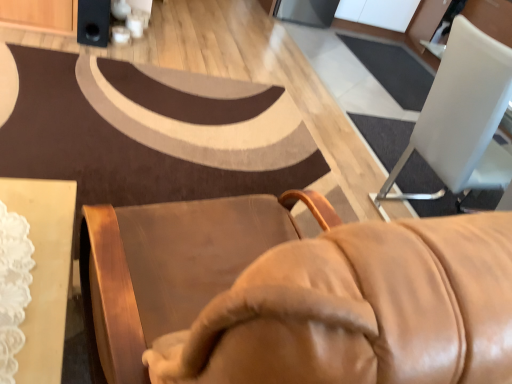
Question: From the image's perspective, is black matte speaker at upper left over white plastic chair at upper right?

Choices:
 (A) yes
 (B) no

Answer: (A)

Question: From a real-world perspective, is black matte speaker at upper left physically below white plastic chair at upper right?

Choices:
 (A) yes
 (B) no

Answer: (A)

Question: From a real-world perspective, is black matte speaker at upper left over white plastic chair at upper right?

Choices:
 (A) no
 (B) yes

Answer: (A)

Question: From the image's perspective, would you say black matte speaker at upper left is shown under white plastic chair at upper right?

Choices:
 (A) no
 (B) yes

Answer: (A)

Question: Does black matte speaker at upper left contain white plastic chair at upper right?

Choices:
 (A) yes
 (B) no

Answer: (B)

Question: Considering the relative sizes of black matte speaker at upper left and white plastic chair at upper right in the image provided, is black matte speaker at upper left wider than white plastic chair at upper right?

Choices:
 (A) yes
 (B) no

Answer: (B)

Question: Is white plastic chair at upper right shorter than black matte speaker at upper left?

Choices:
 (A) yes
 (B) no

Answer: (B)

Question: From a real-world perspective, does white plastic chair at upper right sit lower than black matte speaker at upper left?

Choices:
 (A) no
 (B) yes

Answer: (A)

Question: Can you confirm if white plastic chair at upper right is taller than black matte speaker at upper left?

Choices:
 (A) no
 (B) yes

Answer: (B)

Question: Is white plastic chair at upper right oriented away from black matte speaker at upper left?

Choices:
 (A) yes
 (B) no

Answer: (B)

Question: Does white plastic chair at upper right have a lesser width compared to black matte speaker at upper left?

Choices:
 (A) no
 (B) yes

Answer: (A)

Question: From the image's perspective, is white plastic chair at upper right on black matte speaker at upper left?

Choices:
 (A) yes
 (B) no

Answer: (B)

Question: From a real-world perspective, is black matte speaker at upper left above or below white plastic chair at upper right?

Choices:
 (A) above
 (B) below

Answer: (B)